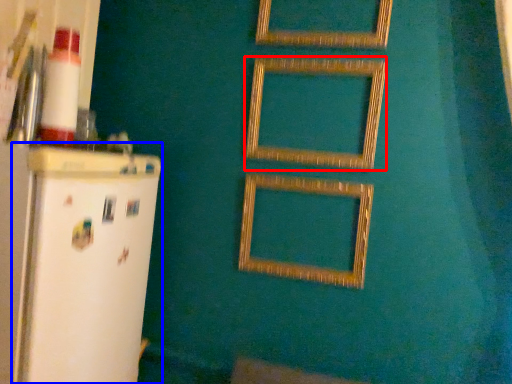
Question: Among these objects, which one is nearest to the camera, picture frame (highlighted by a red box) or fridge (highlighted by a blue box)?

Choices:
 (A) picture frame
 (B) fridge

Answer: (B)